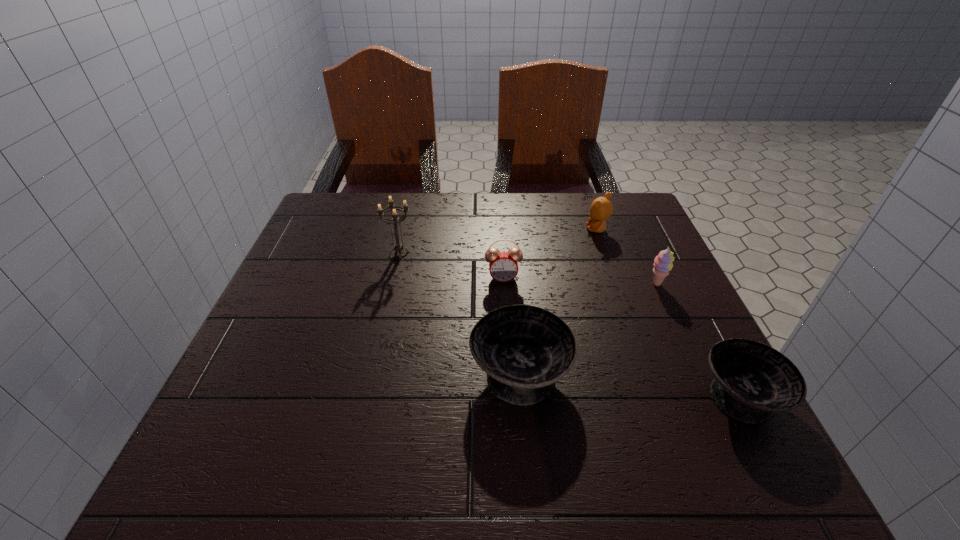
The width and height of the screenshot is (960, 540). I want to click on sherbert that is at the right edge, so click(663, 264).

The image size is (960, 540). What are the coordinates of `object that is at the far right corner` in the screenshot? It's located at (601, 208).

You are a GUI agent. You are given a task and a screenshot of the screen. Output one action in this format:
    pyautogui.click(x=<x>, y=<y>)
    Task: Click on the object present at the near right corner
    The image size is (960, 540).
    Given the screenshot: What is the action you would take?
    pyautogui.click(x=752, y=380)

At what (x,y) coordinates should I click in order to perform the action: click on free space at the far edge of the desktop. Please return your answer as a coordinate pair (x, y). Image resolution: width=960 pixels, height=540 pixels. Looking at the image, I should click on (451, 234).

Find the location of `vacant space at the near edge of the desktop`. vacant space at the near edge of the desktop is located at coordinates (377, 403).

At what (x,y) coordinates should I click in order to perform the action: click on vacant region at the right edge of the desktop. Please return your answer as a coordinate pair (x, y). The height and width of the screenshot is (540, 960). Looking at the image, I should click on click(612, 288).

At what (x,y) coordinates should I click in order to perform the action: click on free space at the far left corner of the desktop. Please return your answer as a coordinate pair (x, y). Looking at the image, I should click on (320, 232).

The image size is (960, 540). I want to click on free space at the near left corner of the desktop, so click(250, 382).

Locate an element on the screen. vacant space at the far right corner of the desktop is located at coordinates (623, 198).

The image size is (960, 540). Find the location of `vacant space at the near right corner of the desktop`. vacant space at the near right corner of the desktop is located at coordinates (691, 382).